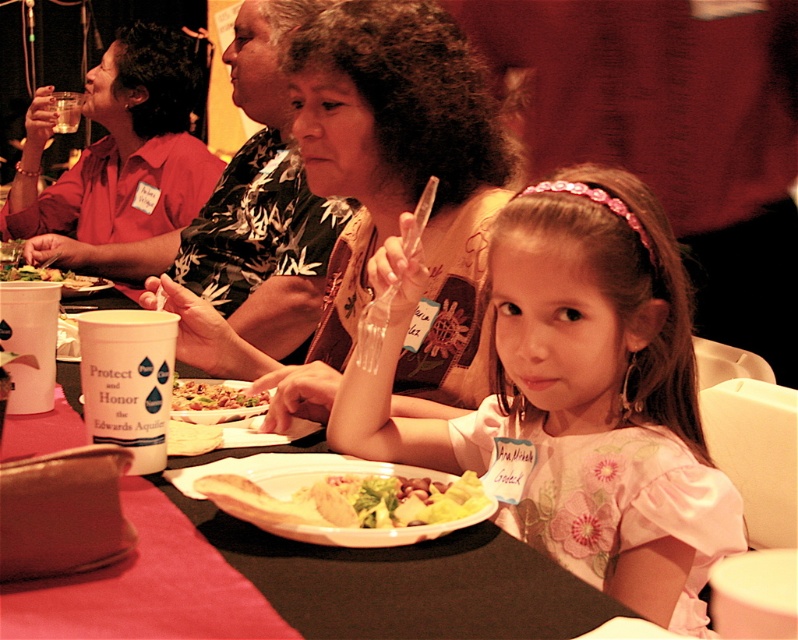
Does pink floral dress at center have a lesser width compared to yellowish matte salad at center?

No.

Is point (524, 397) more distant than point (236, 476)?

That is True.

Where is `pink floral dress at center`? The width and height of the screenshot is (798, 640). pink floral dress at center is located at coordinates (579, 394).

Who is positioned more to the left, white paper plate at center or matte red shirt at upper left?

Positioned to the left is matte red shirt at upper left.

Measure the distance between point (164, 540) and camera.

Point (164, 540) is 26.96 inches away from camera.

Where is `white paper plate at center`? white paper plate at center is located at coordinates (326, 588).

Is point (475, 248) behind point (409, 500)?

Yes, point (475, 248) is behind point (409, 500).

Who is positioned more to the left, printed fabric shirt at center or yellowish matte salad at center?

From the viewer's perspective, printed fabric shirt at center appears more on the left side.

This screenshot has width=798, height=640. What do you see at coordinates (382, 202) in the screenshot?
I see `printed fabric shirt at center` at bounding box center [382, 202].

The height and width of the screenshot is (640, 798). I want to click on printed fabric shirt at center, so click(382, 202).